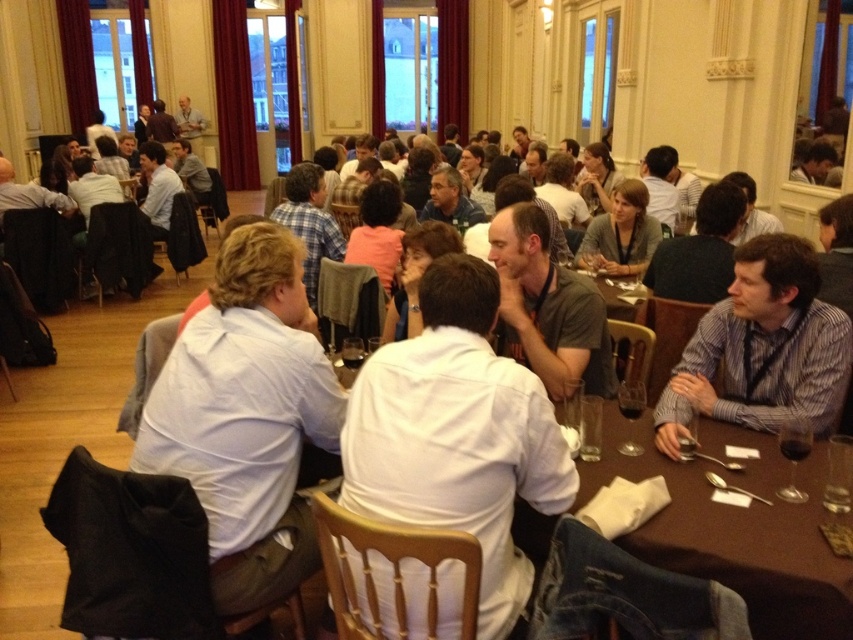
You are standing at the entrance of the hall and want to walk to the brown wooden table at lower right. Which direction should you head towards based on its position?

The brown wooden table at lower right is located at point (735, 528), so you should head towards the lower right direction to reach it.

You are a photographer positioned at the entrance of the hall. You need to take a photo that includes both the striped cotton shirt at right and the brown wooden table at center. Based on their positions, which object should be placed on the right side of the photo frame?

The striped cotton shirt at right should be placed on the right side of the photo frame because it is located to the right of the brown wooden table at center.

You are organizing a photo shoot and need to ensure that the striped cotton shirt at right and the brown wooden table at center are both visible in the frame. Considering their sizes, which object should you prioritize positioning closer to the camera to maintain clarity?

The striped cotton shirt at right is larger in size than the brown wooden table at center, so you should prioritize positioning the striped cotton shirt at right closer to the camera to maintain clarity.